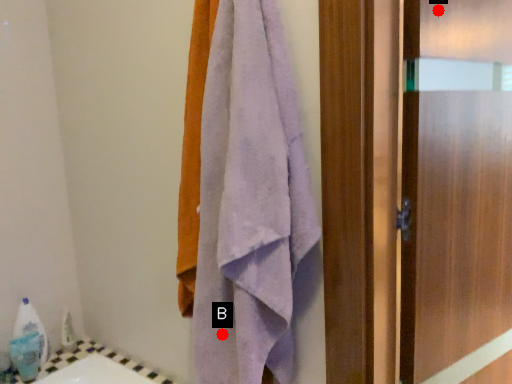
Question: Two points are circled on the image, labeled by A and B beside each circle. Which point is closer to the camera?

Choices:
 (A) A is closer
 (B) B is closer

Answer: (B)